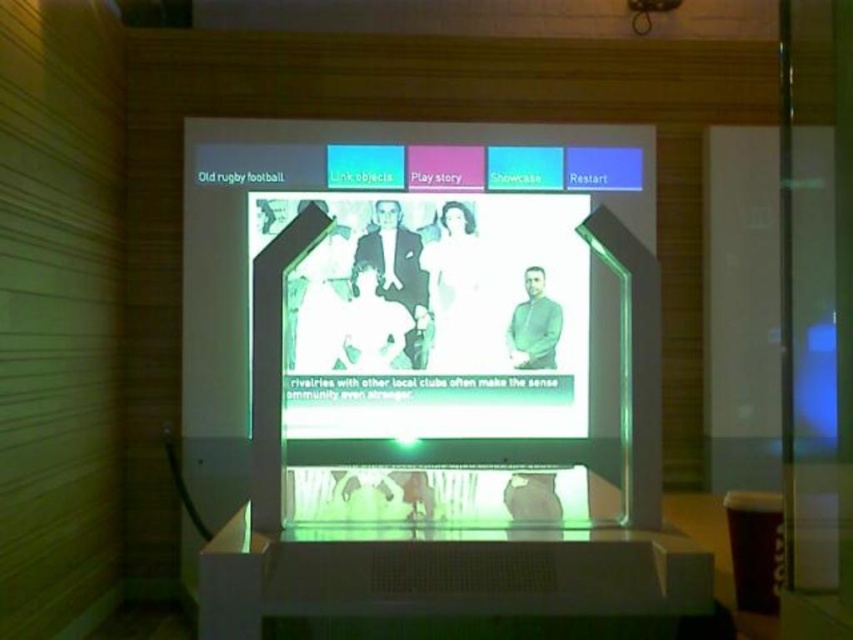
You are setting up an interactive exhibit and need to ensure proper distance between the translucent plastic screen at center and the transparent plastic projector at center. According to the guidelines, the projector should be placed 2 meters away from the screen. Is the current setup compliant?

The translucent plastic screen at center is 2.04 meters from the transparent plastic projector at center. Since 2.04 meters is slightly more than the required 2 meters, the setup is compliant with the guidelines as it meets the minimum distance requirement.

You are a visitor at the exhibit and want to take a photo of the translucent plastic screen at center and transparent plastic projector at center. Which one should you focus on first if you want to capture both in one shot?

The translucent plastic screen at center is to the left of transparent plastic projector at center, so you should focus on the translucent plastic screen at center first to ensure both are in frame.